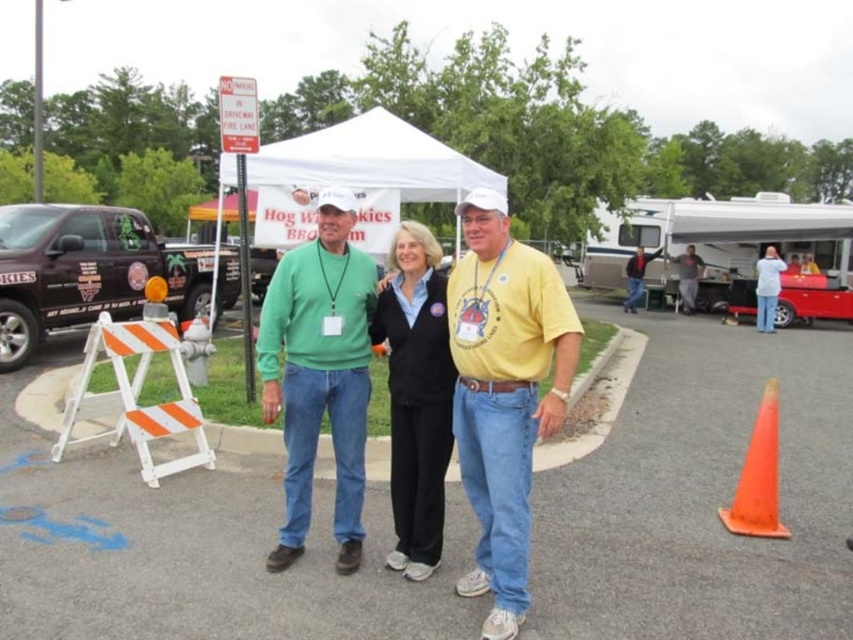
Can you confirm if yellow cotton shirt at center is positioned above white fabric canopy at upper center?

No, yellow cotton shirt at center is not above white fabric canopy at upper center.

Is point (518, 576) farther from camera compared to point (375, 141)?

No, it is not.

Is point (563, 285) positioned before point (285, 163)?

Yes, it is in front of point (285, 163).

At what (x,y) coordinates should I click in order to perform the action: click on yellow cotton shirt at center. Please return your answer as a coordinate pair (x, y). The width and height of the screenshot is (853, 640). Looking at the image, I should click on (503, 392).

Does white cotton shirt at right appear on the right side of white canvas canopy at upper center?

Indeed, white cotton shirt at right is positioned on the right side of white canvas canopy at upper center.

Is white cotton shirt at right positioned behind white canvas canopy at upper center?

Yes, white cotton shirt at right is behind white canvas canopy at upper center.

Which is in front, point (769, 269) or point (200, 209)?

Point (769, 269) is in front.

The image size is (853, 640). I want to click on white cotton shirt at right, so click(767, 288).

Can you confirm if matte green sweater at center is positioned to the left of white fabric canopy at upper center?

Incorrect, matte green sweater at center is not on the left side of white fabric canopy at upper center.

Is matte green sweater at center smaller than white fabric canopy at upper center?

Yes, matte green sweater at center is smaller than white fabric canopy at upper center.

Who is more distant from viewer, (567, 337) or (357, 152)?

Positioned behind is point (357, 152).

At what (x,y) coordinates should I click in order to perform the action: click on matte green sweater at center. Please return your answer as a coordinate pair (x, y). This screenshot has height=640, width=853. Looking at the image, I should click on (503, 392).